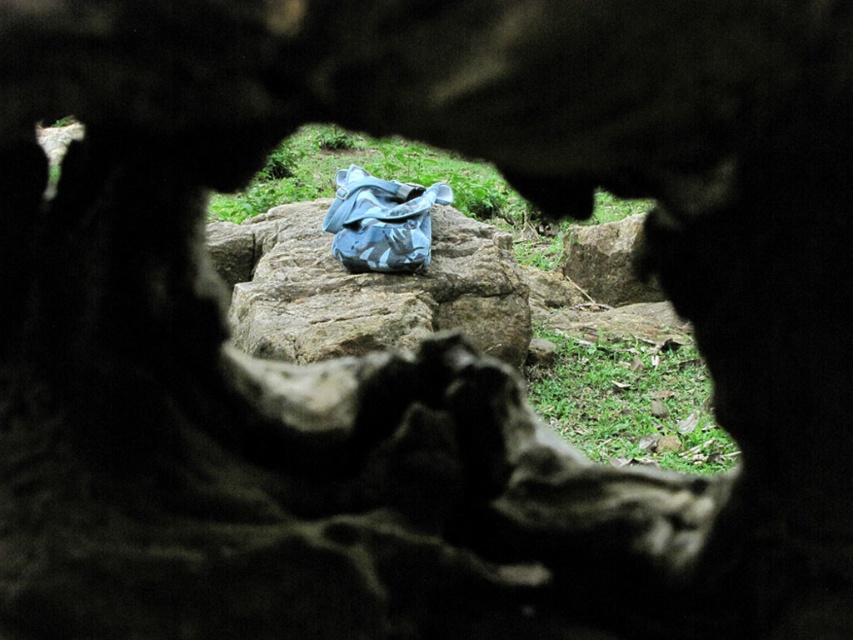
You are standing at the opening of the cave and want to place a small marker at the point closer to you between point (x=236, y=317) and point (x=337, y=244). Which point should you choose?

You should choose point (x=236, y=317) because it is closer to the camera than point (x=337, y=244).

You are standing outside the opening and want to place a small plant between the rough textured rock at center and the blue camouflage bag at center. Based on their positions, which object should the plant be closer to if you want it to be nearer to the rock?

The plant should be placed closer to the rough textured rock at center since it is positioned to the left of the blue camouflage bag at center, so placing it between them would require it to be nearer to the rock to maintain the leftward placement.

You are a hiker who has just found a blue camouflage bag at center near a rough textured rock at center. You want to place a 10 inch long hiking pole between them. Will the pole fit between the two items?

The distance between the rough textured rock at center and the blue camouflage bag at center is 8.43 inches, so the 10 inch long hiking pole will not fit between them since it is longer than the available space.